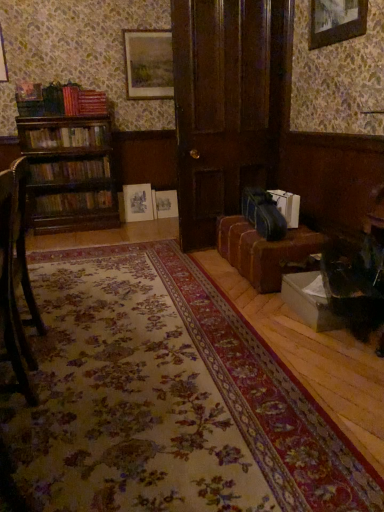
Where is `empty space that is ontop of floral carpet at center (from a real-world perspective)`? The height and width of the screenshot is (512, 384). empty space that is ontop of floral carpet at center (from a real-world perspective) is located at coordinates click(x=151, y=362).